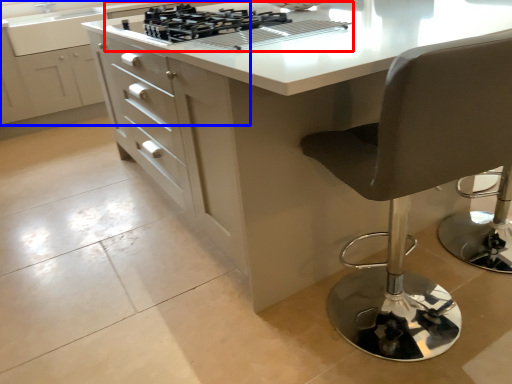
Question: Which object appears farthest to the camera in this image, gas stove (highlighted by a red box) or cabinetry (highlighted by a blue box)?

Choices:
 (A) gas stove
 (B) cabinetry

Answer: (B)